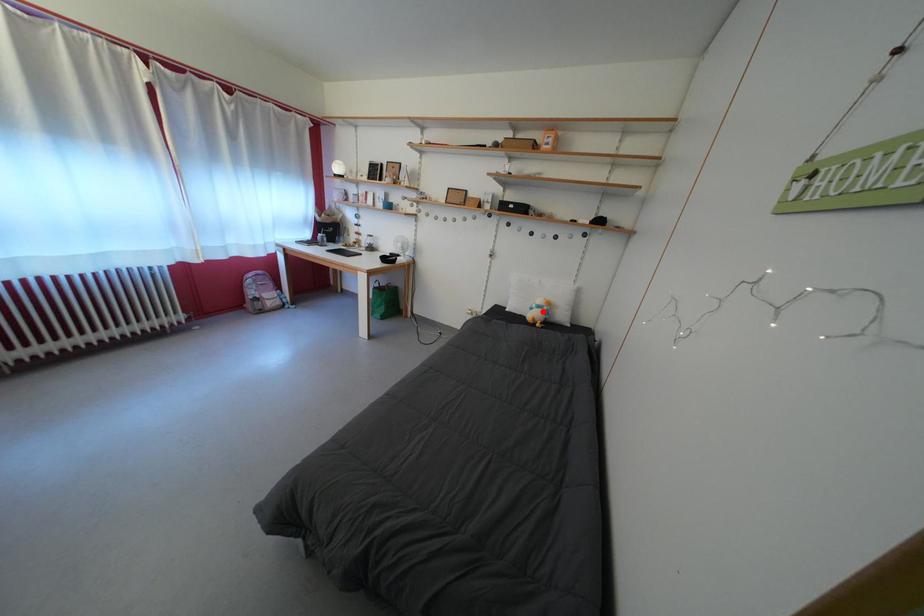
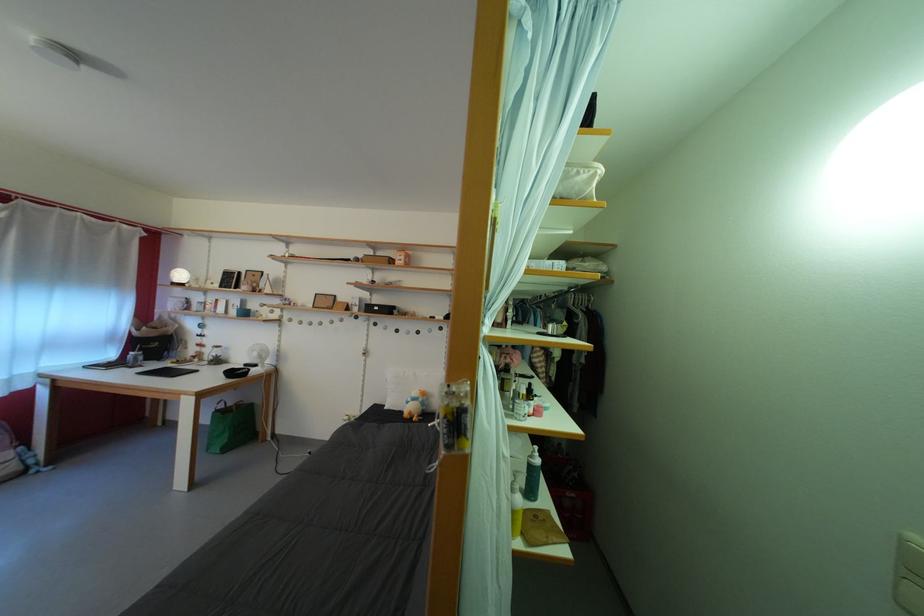
In the second image, find the point that corresponds to the highlighted location in the first image.

(418, 405)